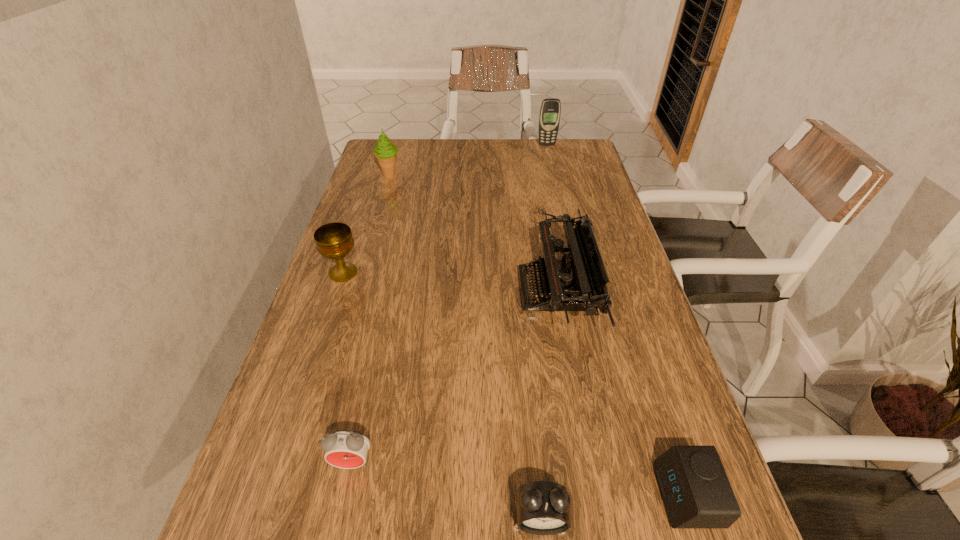
Identify the location of icecream present at the left edge. (385, 152).

Locate an element on the screen. chalice at the left edge is located at coordinates (334, 240).

Locate an element on the screen. The image size is (960, 540). alarm clock located at the left edge is located at coordinates (347, 449).

This screenshot has height=540, width=960. I want to click on cellular telephone that is positioned at the right edge, so click(x=550, y=110).

This screenshot has width=960, height=540. I want to click on typewriter located at the right edge, so click(577, 282).

At what (x,y) coordinates should I click in order to perform the action: click on alarm clock positioned at the right edge. Please return your answer as a coordinate pair (x, y). The width and height of the screenshot is (960, 540). Looking at the image, I should click on (693, 484).

Locate an element on the screen. Image resolution: width=960 pixels, height=540 pixels. object present at the far left corner is located at coordinates (385, 152).

Locate an element on the screen. This screenshot has height=540, width=960. object that is at the far right corner is located at coordinates (550, 110).

The width and height of the screenshot is (960, 540). Identify the location of blank space at the far edge. (494, 139).

In the image, there is a desktop. Where is `vacant space at the left edge`? The image size is (960, 540). vacant space at the left edge is located at coordinates 303,360.